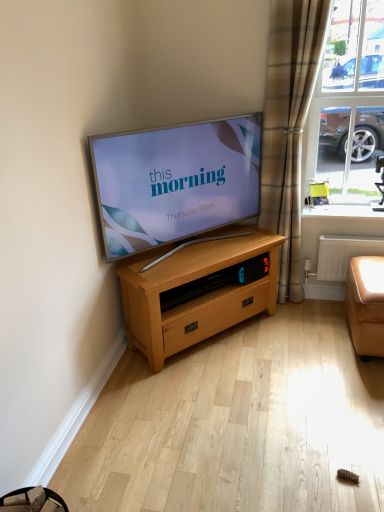
You are a GUI agent. You are given a task and a screenshot of the screen. Output one action in this format:
    pyautogui.click(x=<x>, y=<y>)
    Task: Click on the vacant area that lies between plaid fabric curtain at right and leather-like orange couch at lower right
    The image size is (384, 512).
    Given the screenshot: What is the action you would take?
    pyautogui.click(x=316, y=319)